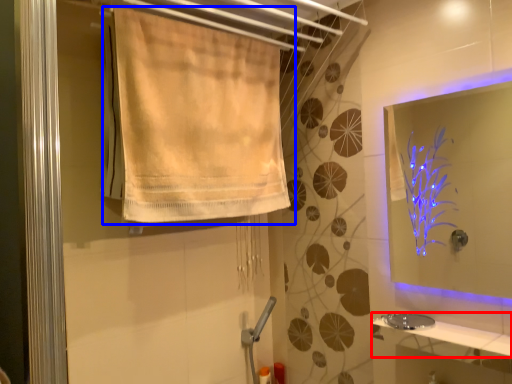
Question: Which of the following is the closest to the observer, counter top (highlighted by a red box) or curtain (highlighted by a blue box)?

Choices:
 (A) counter top
 (B) curtain

Answer: (A)